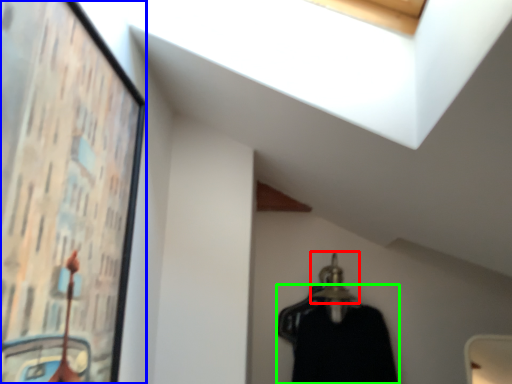
Question: Which is nearer to the hanger (highlighted by a red box)? picture frame (highlighted by a blue box) or clothing (highlighted by a green box).

Choices:
 (A) picture frame
 (B) clothing

Answer: (B)